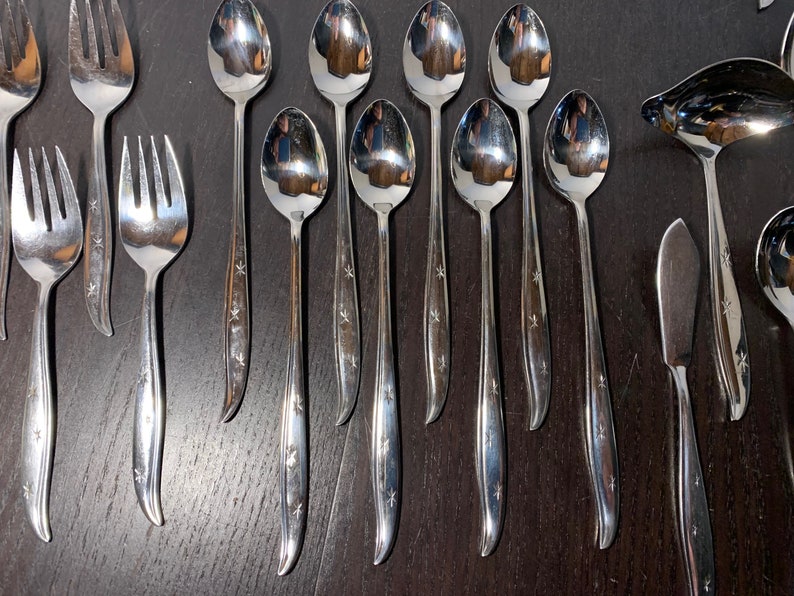
You are a GUI agent. You are given a task and a screenshot of the screen. Output one action in this format:
    pyautogui.click(x=<x>, y=<y>)
    Task: Click on the spoons
    The image size is (794, 596).
    Given the screenshot: What is the action you would take?
    pyautogui.click(x=245, y=54), pyautogui.click(x=294, y=176), pyautogui.click(x=341, y=52), pyautogui.click(x=375, y=159), pyautogui.click(x=475, y=154), pyautogui.click(x=430, y=57), pyautogui.click(x=523, y=48), pyautogui.click(x=579, y=153)